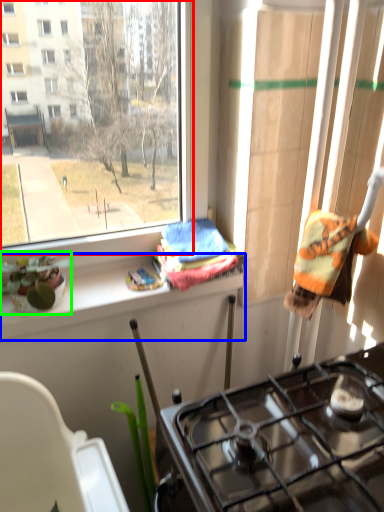
Question: Estimate the real-world distances between objects in this image. Which object is farther from window (highlighted by a red box), ledge (highlighted by a blue box) or houseplant (highlighted by a green box)?

Choices:
 (A) ledge
 (B) houseplant

Answer: (A)